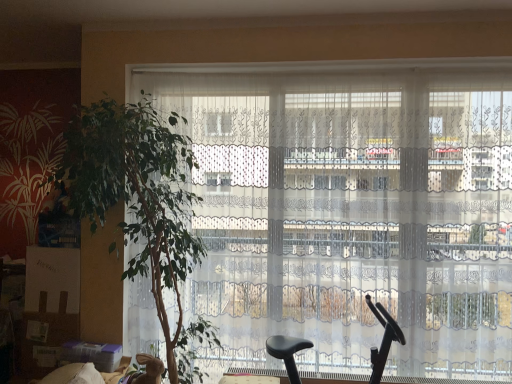
The width and height of the screenshot is (512, 384). What do you see at coordinates (139, 199) in the screenshot?
I see `green leafy plant at left` at bounding box center [139, 199].

Where is `green leafy plant at left`? green leafy plant at left is located at coordinates (139, 199).

What do you see at coordinates (351, 210) in the screenshot? I see `white lace curtains at center` at bounding box center [351, 210].

At what (x,y) coordinates should I click in order to perform the action: click on white lace curtains at center. Please return your answer as a coordinate pair (x, y). This screenshot has width=512, height=384. Looking at the image, I should click on (351, 210).

Locate an element on the screen. green leafy plant at left is located at coordinates (139, 199).

Looking at this image, is green leafy plant at left facing away from black plastic baby carriage at center?

No, green leafy plant at left is not facing the opposite direction of black plastic baby carriage at center.

Which is behind, point (106, 132) or point (390, 321)?

The point (390, 321) is more distant.

Find the location of `baby carriage directly beneath the green leafy plant at left (from a real-world perspective)`. baby carriage directly beneath the green leafy plant at left (from a real-world perspective) is located at coordinates (383, 339).

Looking at this image, what's the angular difference between green leafy plant at left and black plastic baby carriage at center's facing directions?

The angular difference between green leafy plant at left and black plastic baby carriage at center is 1.43 degrees.

Is point (393, 333) closer to viewer compared to point (189, 352)?

No, it is behind (189, 352).

Between black plastic baby carriage at center and green leafy plant at left, which one has less height?

With less height is black plastic baby carriage at center.

From a real-world perspective, who is located higher, black plastic baby carriage at center or green leafy plant at left?

In real-world perspective, green leafy plant at left is above.

Is black plastic baby carriage at center placed right next to green leafy plant at left?

There is a gap between black plastic baby carriage at center and green leafy plant at left.

Is black plastic baby carriage at center not close to white lace curtains at center?

black plastic baby carriage at center is actually quite close to white lace curtains at center.

Considering the points (284, 360) and (361, 110), which point is behind, point (284, 360) or point (361, 110)?

Point (284, 360)

From a real-world perspective, is black plastic baby carriage at center positioned over white lace curtains at center based on gravity?

No.

Is black plastic baby carriage at center positioned with its back to white lace curtains at center?

Absolutely, black plastic baby carriage at center is directed away from white lace curtains at center.

From the image's perspective, which one is positioned lower, green leafy plant at left or white lace curtains at center?

green leafy plant at left.

Is green leafy plant at left bigger or smaller than white lace curtains at center?

Clearly, green leafy plant at left is larger in size than white lace curtains at center.

Is there a large distance between green leafy plant at left and white lace curtains at center?

No.

Based on their sizes in the image, would you say white lace curtains at center is bigger or smaller than green leafy plant at left?

In the image, white lace curtains at center appears to be smaller than green leafy plant at left.

Which object is positioned more to the left, white lace curtains at center or green leafy plant at left?

green leafy plant at left is more to the left.

Are white lace curtains at center and green leafy plant at left beside each other?

No, white lace curtains at center is not touching green leafy plant at left.

Does white lace curtains at center turn towards green leafy plant at left?

Yes, white lace curtains at center faces towards green leafy plant at left.

Does white lace curtains at center lie in front of black plastic baby carriage at center?

That is False.

Is white lace curtains at center looking in the opposite direction of black plastic baby carriage at center?

Yes, white lace curtains at center is facing away from black plastic baby carriage at center.

From a real-world perspective, is white lace curtains at center physically below black plastic baby carriage at center?

Actually, white lace curtains at center is physically above black plastic baby carriage at center in the real world.

Would you say white lace curtains at center is outside black plastic baby carriage at center?

white lace curtains at center lies outside black plastic baby carriage at center's area.

Where is `baby carriage that appears below the green leafy plant at left (from a real-world perspective)`? This screenshot has height=384, width=512. baby carriage that appears below the green leafy plant at left (from a real-world perspective) is located at coordinates (383, 339).

This screenshot has width=512, height=384. Identify the location of baby carriage that appears below the green leafy plant at left (from the image's perspective). (383, 339).

Considering their positions, is green leafy plant at left positioned further to black plastic baby carriage at center than white lace curtains at center?

Among the two, green leafy plant at left is located further to black plastic baby carriage at center.

Estimate the real-world distances between objects in this image. Which object is closer to black plastic baby carriage at center, white lace curtains at center or green leafy plant at left?

white lace curtains at center is closer to black plastic baby carriage at center.

Looking at the image, which one is located further to green leafy plant at left, black plastic baby carriage at center or white lace curtains at center?

black plastic baby carriage at center.

Estimate the real-world distances between objects in this image. Which object is further from green leafy plant at left, white lace curtains at center or black plastic baby carriage at center?

black plastic baby carriage at center is further to green leafy plant at left.

Estimate the real-world distances between objects in this image. Which object is further from white lace curtains at center, black plastic baby carriage at center or green leafy plant at left?

Among the two, black plastic baby carriage at center is located further to white lace curtains at center.

Considering their positions, is green leafy plant at left positioned further to white lace curtains at center than black plastic baby carriage at center?

The object further to white lace curtains at center is black plastic baby carriage at center.

This screenshot has width=512, height=384. I want to click on window located between green leafy plant at left and black plastic baby carriage at center in the left-right direction, so click(x=351, y=210).